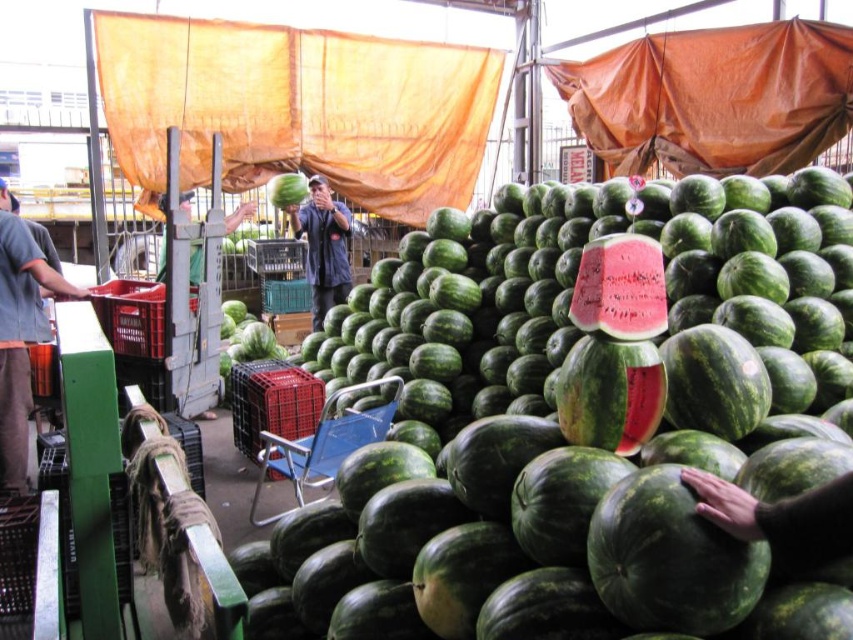
You are a customer at the market and want to buy a watermelon. You see the ripe red watermelon at center and the green matte watermelon at center. Which one is thinner?

The ripe red watermelon at center is thinner than the green matte watermelon at center.

In the scene shown: You are standing in the market and want to pick the watermelon that is closer to you. The watermelons are labeled as point at [618,323] and point at [305,179]. Which point corresponds to the closer watermelon?

Point at [618,323] is closer to the viewer than point at [305,179].